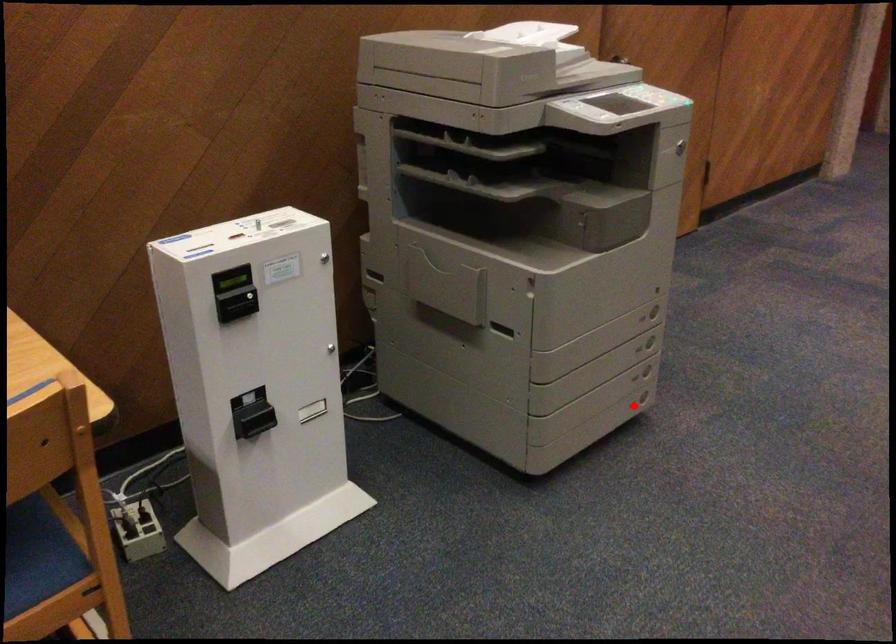
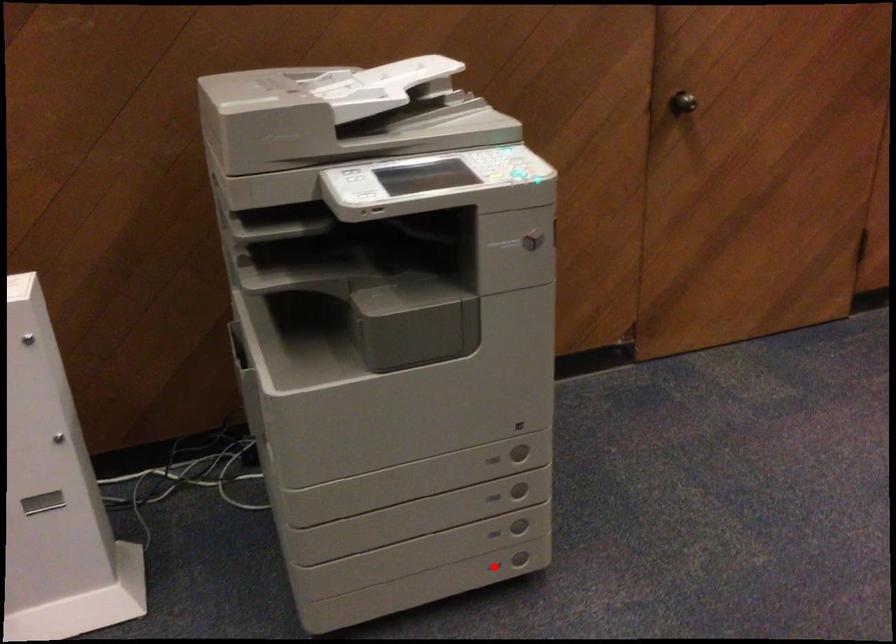
I am providing you with two images of the same scene from different viewpoints. A red point is marked on the first image and another point is marked on the second image. Is the red point in image1 aligned with the point shown in image2?

Yes